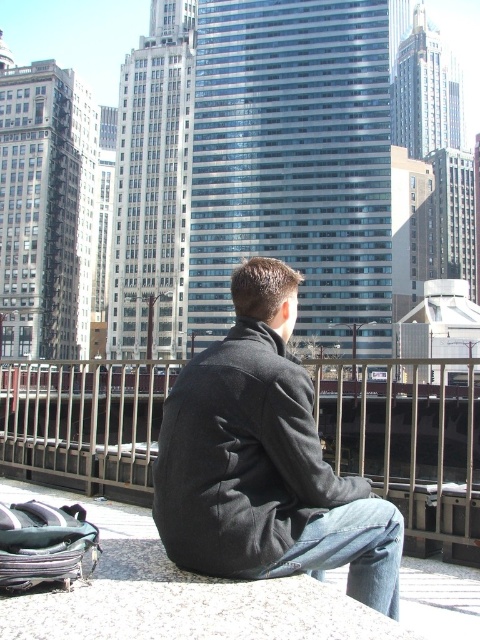
Between point (191, 497) and point (389, 584), which one is positioned in front?

Point (191, 497) is in front.

Is dark gray wool coat at center smaller than denim at lower right?

No.

Image resolution: width=480 pixels, height=640 pixels. I want to click on dark gray wool coat at center, so click(264, 461).

Is dark gray wool coat at center smaller than metallic silver rail at center?

Yes.

Does dark gray wool coat at center have a greater width compared to metallic silver rail at center?

No, dark gray wool coat at center is not wider than metallic silver rail at center.

Where is `dark gray wool coat at center`? dark gray wool coat at center is located at coordinates (264, 461).

Looking at this image, is metallic silver rail at center above denim at lower right?

Actually, metallic silver rail at center is below denim at lower right.

Describe the element at coordinates (408, 442) in the screenshot. The width and height of the screenshot is (480, 640). I see `metallic silver rail at center` at that location.

Identify the location of metallic silver rail at center. The height and width of the screenshot is (640, 480). (408, 442).